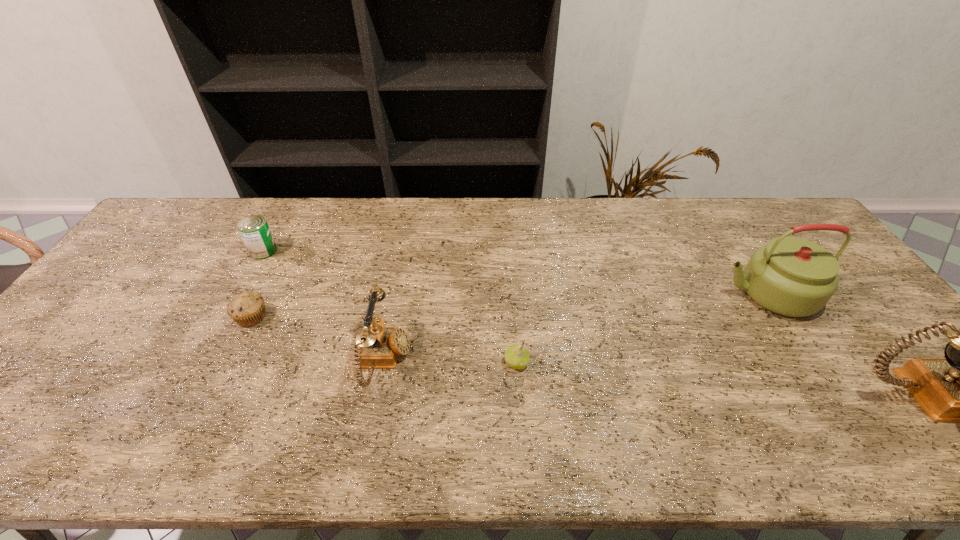
This screenshot has height=540, width=960. I want to click on free space for an extra telephone to achieve even spacing, so click(x=648, y=381).